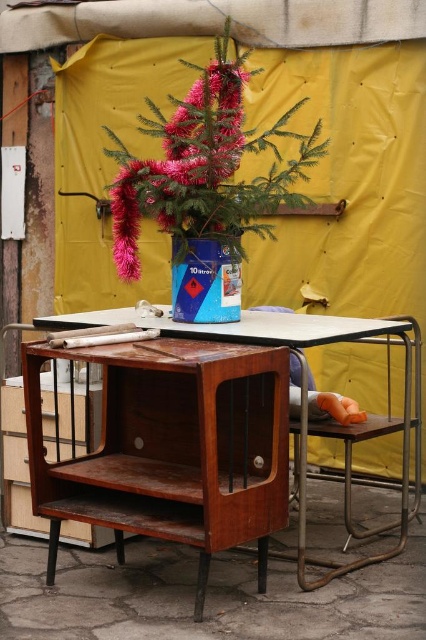
Is point (114, 150) farther from viewer compared to point (345, 566)?

Yes, it is behind point (345, 566).

Is shiny pink artificial tree at center above wooden table at center?

Indeed, shiny pink artificial tree at center is positioned over wooden table at center.

Measure the distance between point (207, 124) and camera.

Point (207, 124) is 11.73 feet away from camera.

Where is `shiny pink artificial tree at center`? This screenshot has width=426, height=640. shiny pink artificial tree at center is located at coordinates (204, 168).